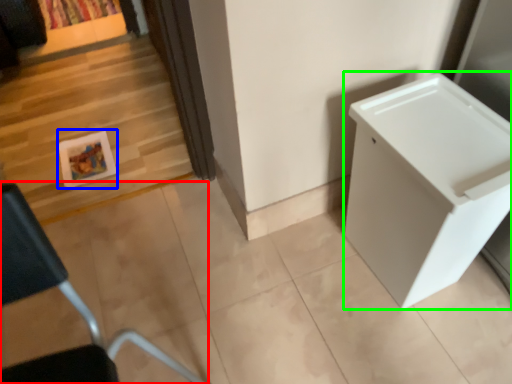
Question: Estimate the real-world distances between objects in this image. Which object is closer to furniture (highlighted by a red box), picture frame (highlighted by a blue box) or changing table (highlighted by a green box)?

Choices:
 (A) picture frame
 (B) changing table

Answer: (B)